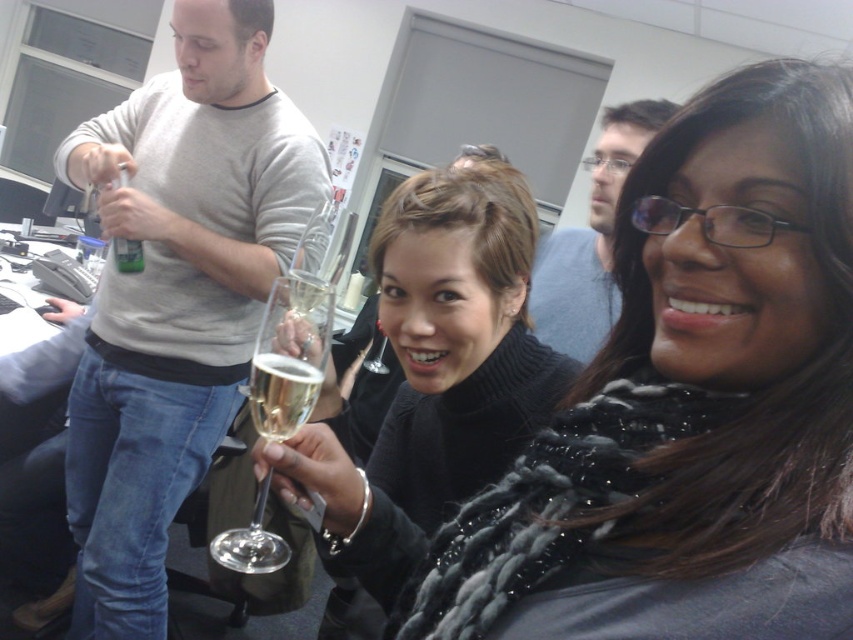
Question: Which object appears closest to the camera in this image?

Choices:
 (A) gray matte sweater at upper left
 (B) gold metallic champagne glass at center

Answer: (B)

Question: Can you confirm if matte black turtleneck sweater at center is positioned above clear glass wine glass at center?

Choices:
 (A) no
 (B) yes

Answer: (B)

Question: Which point is farther to the camera?

Choices:
 (A) (416, 426)
 (B) (167, 124)
 (C) (294, 362)

Answer: (B)

Question: Can you confirm if clear glass wine glass at center is positioned below matte glass bottle at upper left?

Choices:
 (A) yes
 (B) no

Answer: (A)

Question: Which object appears farthest from the camera in this image?

Choices:
 (A) gray matte sweater at upper left
 (B) black textured scarf at center
 (C) gold metallic champagne glass at center

Answer: (A)

Question: Can you confirm if gray matte sweater at upper left is positioned to the left of matte black turtleneck sweater at center?

Choices:
 (A) yes
 (B) no

Answer: (A)